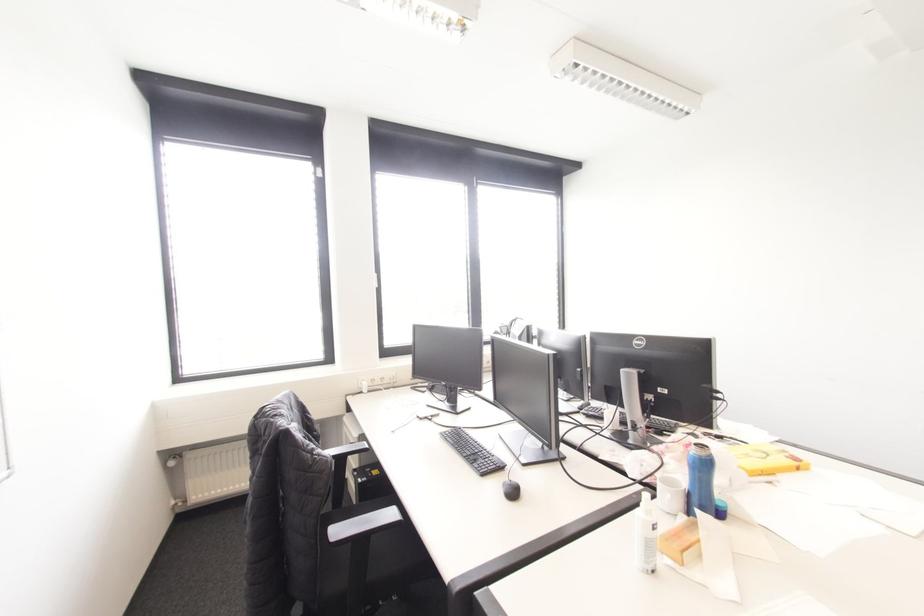
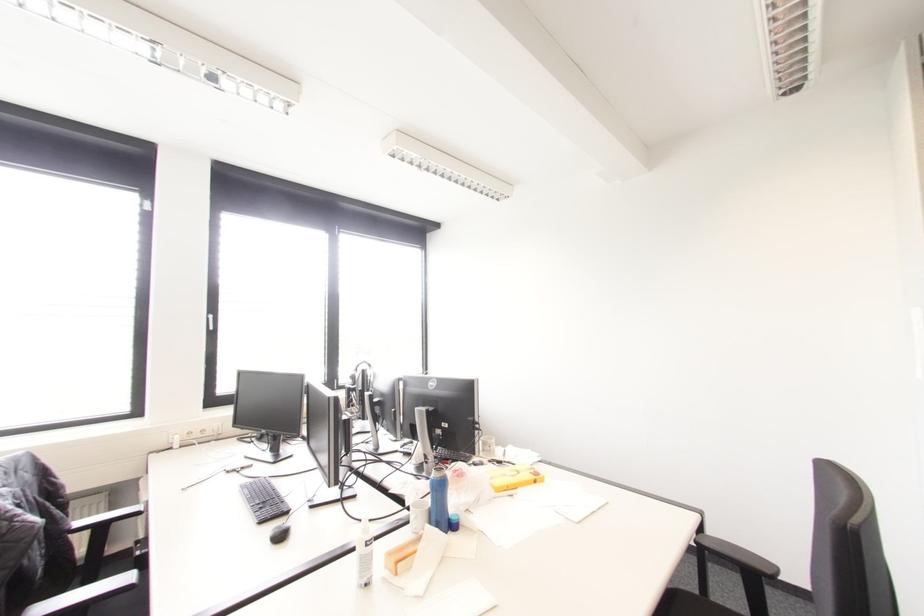
In the second image, find the point that corresponds to (687,493) in the first image.

(429, 512)